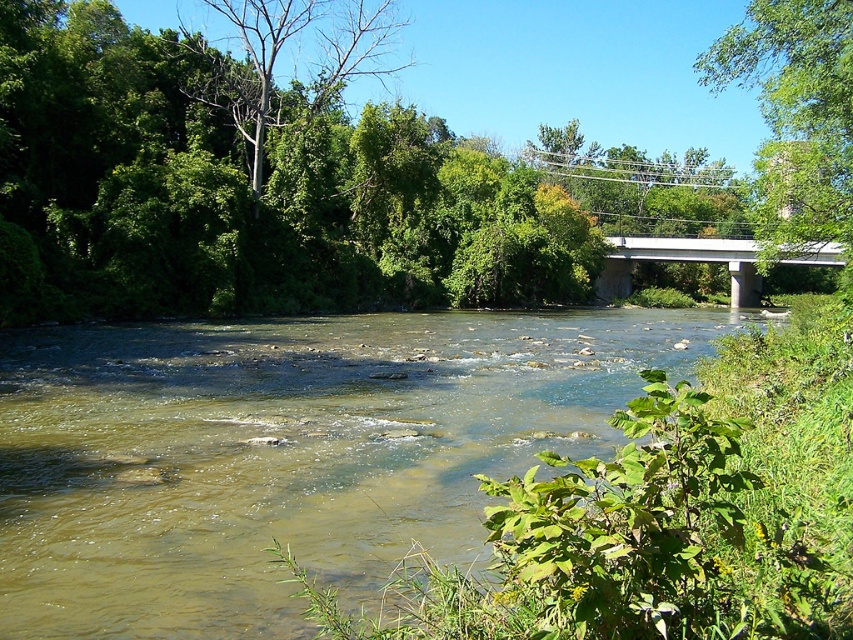
Which is above, brown sedimentary stream at center or white concrete bridge at upper center?

white concrete bridge at upper center

Is the position of brown sedimentary stream at center more distant than that of white concrete bridge at upper center?

No.

Locate an element on the screen. The width and height of the screenshot is (853, 640). brown sedimentary stream at center is located at coordinates (286, 452).